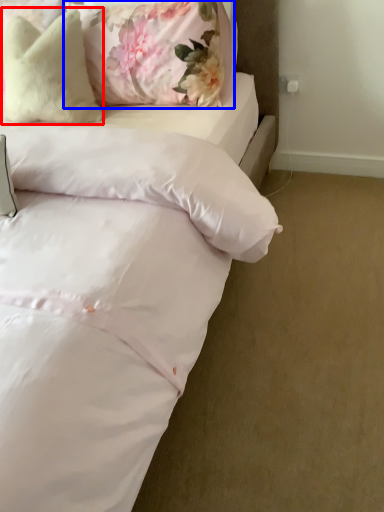
Question: Which object appears closest to the camera in this image, pillow (highlighted by a red box) or pillow (highlighted by a blue box)?

Choices:
 (A) pillow
 (B) pillow

Answer: (B)